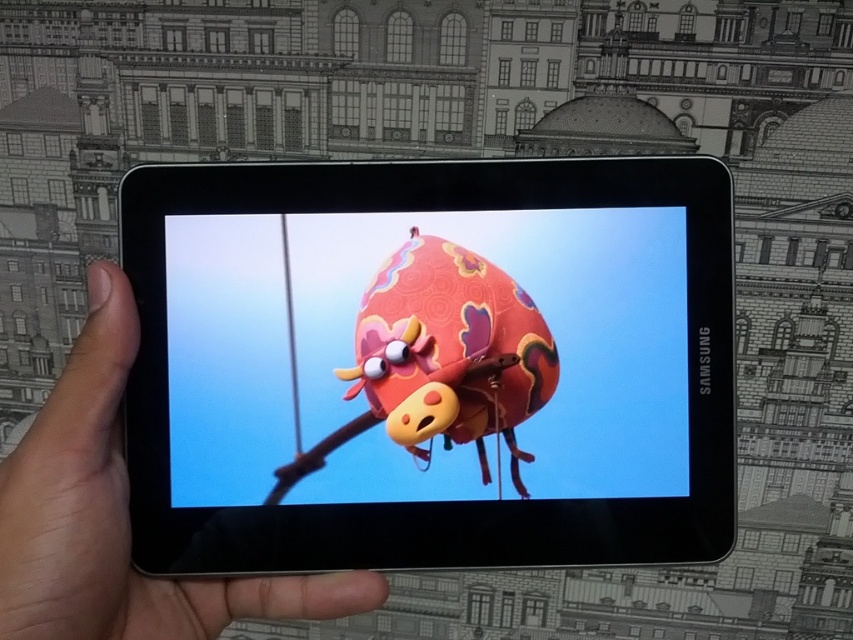
You are a delivery person who needs to hand over a black glossy tablet at center to a customer. However, there is another matte black tablet at center on the table. How far apart are the two tablets?

The black glossy tablet at center is 3.11 inches away from the matte black tablet at center.

You are a 3D model designer working on a project. You need to determine which of the two points, point (318, 422) or point (184, 586), is closer to the viewer in the image. Based on the scene, can you identify the closer point?

Point (318, 422) is closer to the viewer than point (184, 586).

You are an assistant helping someone choose between two tablets displayed in a store. The scene shows a black glossy tablet at center and a matte black tablet at center. Which tablet is positioned to the right of the other?

The black glossy tablet at center is to the right of the matte black tablet at center.